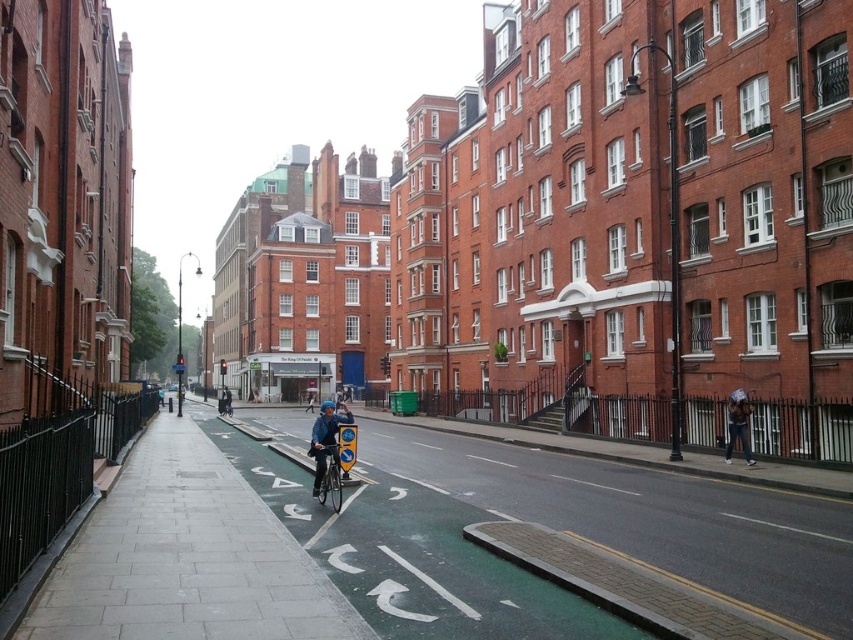
Does point (219, 497) come closer to viewer compared to point (734, 400)?

Yes, point (219, 497) is in front of point (734, 400).

Does gray concrete pavement at center have a lesser height compared to denim jacket at lower right?

No.

Does point (97, 637) come farther from viewer compared to point (727, 458)?

No, (97, 637) is in front of (727, 458).

This screenshot has width=853, height=640. What are the coordinates of `gray concrete pavement at center` in the screenshot? It's located at (186, 557).

Does green rubber bike lane at center have a greater height compared to blue matte bicycle helmet at center?

No.

Between green rubber bike lane at center and blue matte bicycle helmet at center, which one appears on the right side from the viewer's perspective?

green rubber bike lane at center is more to the right.

Who is more distant from viewer, (410, 563) or (325, 401)?

The point (325, 401) is behind.

Identify the location of green rubber bike lane at center. The width and height of the screenshot is (853, 640). (412, 556).

Is green rubber bike lane at center bigger than silver metallic bicycle at center?

Yes.

Is the position of green rubber bike lane at center less distant than that of silver metallic bicycle at center?

Yes, it is.

Does point (346, 529) come in front of point (318, 452)?

Yes, it is in front of point (318, 452).

Identify the location of green rubber bike lane at center. (412, 556).